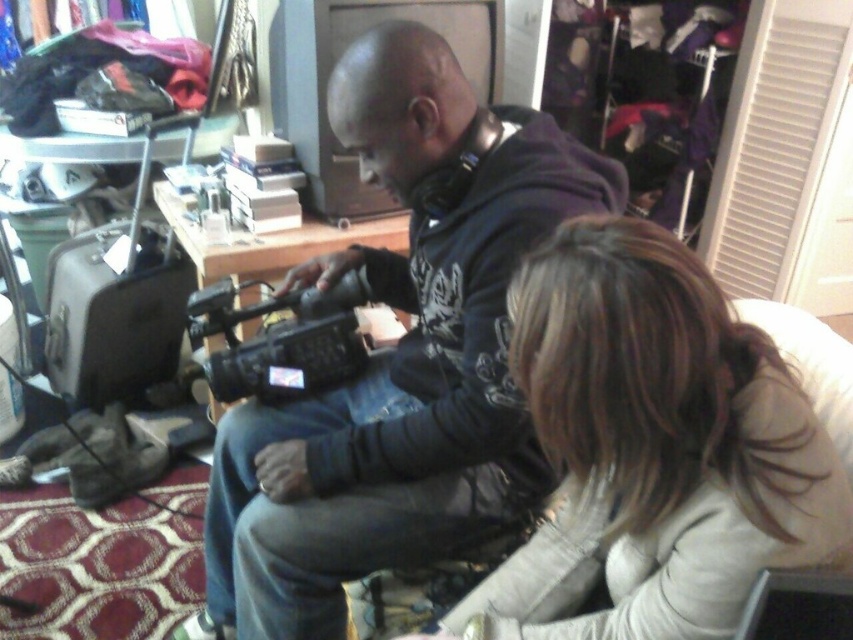
Find the location of a particular element. The height and width of the screenshot is (640, 853). matte black camera at center is located at coordinates 399,355.

Between matte black camera at center and black plastic video camera at center, which one has less height?

With less height is black plastic video camera at center.

Who is more forward, (415, 349) or (329, 326)?

Positioned in front is point (329, 326).

The image size is (853, 640). What are the coordinates of `matte black camera at center` in the screenshot? It's located at (399, 355).

Does smooth beige sweater at lower right appear on the left side of black plastic video camera at center?

In fact, smooth beige sweater at lower right is to the right of black plastic video camera at center.

Is point (601, 568) less distant than point (276, 342)?

Yes, it is in front of point (276, 342).

At what (x,y) coordinates should I click in order to perform the action: click on smooth beige sweater at lower right. Please return your answer as a coordinate pair (x, y). Looking at the image, I should click on (653, 448).